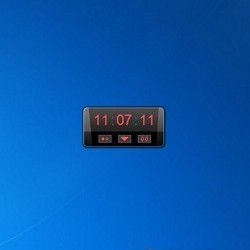
This screenshot has width=250, height=250. Identify the location of empty space right of clock. (x=205, y=135).